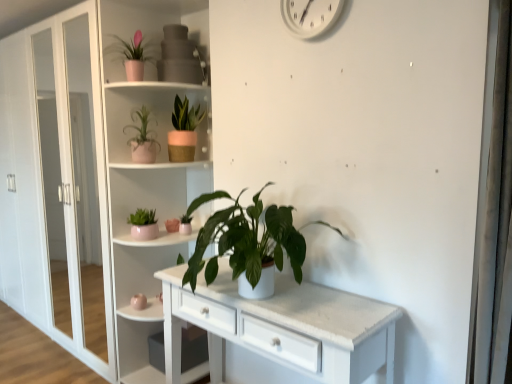
This screenshot has height=384, width=512. What do you see at coordinates (172, 225) in the screenshot? I see `matte pink vase at center` at bounding box center [172, 225].

What do you see at coordinates (310, 16) in the screenshot? I see `white plastic clock at upper center` at bounding box center [310, 16].

In order to face white plastic clock at upper center, should I rotate leftwards or rightwards?

Rotate your view right by about 7.416°.

What do you see at coordinates (144, 224) in the screenshot? This screenshot has width=512, height=384. I see `matte pink pot at center-left, the 2th houseplant from the bottom` at bounding box center [144, 224].

What do you see at coordinates (130, 55) in the screenshot?
I see `matte pink pot at upper left, placed as the fifth houseplant when sorted from bottom to top` at bounding box center [130, 55].

In order to click on green matte plant at center, arranged as the fifth houseplant when viewed from the top in this screenshot , I will do `click(246, 239)`.

Locate an element on the screen. Image resolution: width=512 pixels, height=384 pixels. white glossy shelves at center is located at coordinates (149, 170).

Find the location of a particular element. matte pink vase at center is located at coordinates (172, 225).

Is white plastic clock at upper center positioned behind matte pink vase at center?

No, the depth of white plastic clock at upper center is less than that of matte pink vase at center.

This screenshot has width=512, height=384. Identify the location of clock in front of the matte pink vase at center. (310, 16).

Between white plastic clock at upper center and matte pink vase at center, which one has smaller size?

matte pink vase at center.

Does white plastic clock at upper center have a greater height compared to matte pink vase at center?

Yes.

Is white glossy shelves at center far from matte pink pot at upper center, placed as the third houseplant when sorted from top to bottom?

No.

Which of these two, white glossy shelves at center or matte pink pot at upper center, which is counted as the 3th houseplant, starting from the bottom, is wider?

white glossy shelves at center.

Is white glossy shelves at center at the right side of matte pink pot at upper center, which is counted as the 3th houseplant, starting from the bottom?

Indeed, white glossy shelves at center is positioned on the right side of matte pink pot at upper center, which is counted as the 3th houseplant, starting from the bottom.

From a real-world perspective, count 1st houseplants upward from the white glossy shelves at center and point to it. Please provide its 2D coordinates.

[(143, 138)]

Consider the image. Is matte pink pot at center-left, the 2th houseplant from the bottom, further to the viewer compared to pink matte pot at upper center, placed as the second houseplant when sorted from top to bottom?

No, it is in front of pink matte pot at upper center, placed as the second houseplant when sorted from top to bottom.

Is matte pink pot at center-left, the 2th houseplant from the bottom, not within pink matte pot at upper center, the fourth houseplant positioned from the bottom?

Yes, matte pink pot at center-left, the 2th houseplant from the bottom, is located beyond the bounds of pink matte pot at upper center, the fourth houseplant positioned from the bottom.

Visually, is matte pink pot at center-left, which is the 4th houseplant from top to bottom, positioned to the left or to the right of pink matte pot at upper center, placed as the second houseplant when sorted from top to bottom?

Clearly, matte pink pot at center-left, which is the 4th houseplant from top to bottom, is on the left of pink matte pot at upper center, placed as the second houseplant when sorted from top to bottom, in the image.

Does matte pink pot at center-left, which is the 4th houseplant from top to bottom, have a smaller size compared to pink matte pot at upper center, placed as the second houseplant when sorted from top to bottom?

Correct, matte pink pot at center-left, which is the 4th houseplant from top to bottom, occupies less space than pink matte pot at upper center, placed as the second houseplant when sorted from top to bottom.

From the image's perspective, which is above, matte pink pot at upper left, placed as the fifth houseplant when sorted from bottom to top, or white plastic clock at upper center?

white plastic clock at upper center, from the image's perspective.

Do you think matte pink pot at upper left, marked as the 1th houseplant in a top-to-bottom arrangement, is within white plastic clock at upper center, or outside of it?

The correct answer is: outside.

From a real-world perspective, is pink matte pot at upper center, the fourth houseplant positioned from the bottom, physically above matte pink pot at upper center, placed as the third houseplant when sorted from top to bottom?

Yes, from a real-world perspective, pink matte pot at upper center, the fourth houseplant positioned from the bottom, is on top of matte pink pot at upper center, placed as the third houseplant when sorted from top to bottom.

Is pink matte pot at upper center, placed as the second houseplant when sorted from top to bottom, inside the boundaries of matte pink pot at upper center, which is counted as the 3th houseplant, starting from the bottom, or outside?

pink matte pot at upper center, placed as the second houseplant when sorted from top to bottom, is located beyond the bounds of matte pink pot at upper center, which is counted as the 3th houseplant, starting from the bottom.

Is point (173, 135) closer or farther from the camera than point (135, 111)?

Point (173, 135) is positioned farther from the camera compared to point (135, 111).

Between pink matte pot at upper center, placed as the second houseplant when sorted from top to bottom, and matte pink pot at upper center, which is counted as the 3th houseplant, starting from the bottom, which one has less height?

With less height is matte pink pot at upper center, which is counted as the 3th houseplant, starting from the bottom.

Who is more distant, matte pink pot at upper center, placed as the third houseplant when sorted from top to bottom, or matte pink pot at upper left, marked as the 1th houseplant in a top-to-bottom arrangement?

matte pink pot at upper center, placed as the third houseplant when sorted from top to bottom, is further from the camera.

Based on their positions, is matte pink pot at upper center, which is counted as the 3th houseplant, starting from the bottom, located to the left or right of matte pink pot at upper left, placed as the fifth houseplant when sorted from bottom to top?

Clearly, matte pink pot at upper center, which is counted as the 3th houseplant, starting from the bottom, is on the right of matte pink pot at upper left, placed as the fifth houseplant when sorted from bottom to top, in the image.

Is matte pink pot at upper center, placed as the third houseplant when sorted from top to bottom, bigger than matte pink pot at upper left, marked as the 1th houseplant in a top-to-bottom arrangement?

Correct, matte pink pot at upper center, placed as the third houseplant when sorted from top to bottom, is larger in size than matte pink pot at upper left, marked as the 1th houseplant in a top-to-bottom arrangement.

Is point (156, 122) positioned behind point (123, 52)?

That is True.

Considering the sizes of objects matte pink pot at center-left, the 2th houseplant from the bottom, and matte pink pot at upper left, placed as the fifth houseplant when sorted from bottom to top, in the image provided, who is bigger, matte pink pot at center-left, the 2th houseplant from the bottom, or matte pink pot at upper left, placed as the fifth houseplant when sorted from bottom to top,?

matte pink pot at upper left, placed as the fifth houseplant when sorted from bottom to top, is bigger.

Considering the positions of point (140, 212) and point (111, 34), is point (140, 212) closer or farther from the camera than point (111, 34)?

Clearly, point (140, 212) is more distant from the camera than point (111, 34).

From a real-world perspective, which object rests below the other?

matte pink pot at center-left, which is the 4th houseplant from top to bottom, from a real-world perspective.

Locate an element on the screen. flower on the left of white plastic clock at upper center is located at coordinates (172, 225).

Identify the location of bookshelf below the matte pink pot at upper center, placed as the third houseplant when sorted from top to bottom (from the image's perspective). This screenshot has height=384, width=512. [149, 170].

Looking at the image, which one is located further to matte pink pot at center-left, the 2th houseplant from the bottom, white plastic clock at upper center or pink matte pot at upper center, placed as the second houseplant when sorted from top to bottom?

white plastic clock at upper center lies further to matte pink pot at center-left, the 2th houseplant from the bottom, than the other object.

Which object lies further to the anchor point white glossy shelves at center, pink matte pot at upper center, placed as the second houseplant when sorted from top to bottom, or matte pink pot at center-left, which is the 4th houseplant from top to bottom?

matte pink pot at center-left, which is the 4th houseplant from top to bottom, is further to white glossy shelves at center.

Considering their positions, is white glossy shelves at center positioned further to white plastic clock at upper center than pink matte pot at upper center, the fourth houseplant positioned from the bottom?

white glossy shelves at center.

Considering their positions, is matte pink pot at center-left, which is the 4th houseplant from top to bottom, positioned closer to pink matte pot at upper center, placed as the second houseplant when sorted from top to bottom, than matte pink pot at upper center, placed as the third houseplant when sorted from top to bottom?

Based on the image, matte pink pot at upper center, placed as the third houseplant when sorted from top to bottom, appears to be nearer to pink matte pot at upper center, placed as the second houseplant when sorted from top to bottom.

Looking at this image, estimate the real-world distances between objects in this image. Which object is further from green matte plant at center, the first houseplant from the bottom, matte pink vase at center or white plastic clock at upper center?

The object further to green matte plant at center, the first houseplant from the bottom, is white plastic clock at upper center.

Which object lies nearer to the anchor point green matte plant at center, arranged as the fifth houseplant when viewed from the top, white plastic clock at upper center or pink matte pot at upper center, placed as the second houseplant when sorted from top to bottom?

Among the two, pink matte pot at upper center, placed as the second houseplant when sorted from top to bottom, is located nearer to green matte plant at center, arranged as the fifth houseplant when viewed from the top.

Estimate the real-world distances between objects in this image. Which object is closer to matte pink vase at center, white plastic clock at upper center or matte pink pot at upper center, placed as the third houseplant when sorted from top to bottom?

The object closer to matte pink vase at center is matte pink pot at upper center, placed as the third houseplant when sorted from top to bottom.

Looking at the image, which one is located closer to matte pink vase at center, matte pink pot at center-left, which is the 4th houseplant from top to bottom, or white glossy shelves at center?

matte pink pot at center-left, which is the 4th houseplant from top to bottom, is closer to matte pink vase at center.

Find the location of a particular element. The image size is (512, 384). bookshelf that lies between matte pink pot at upper center, placed as the third houseplant when sorted from top to bottom, and matte pink pot at center-left, which is the 4th houseplant from top to bottom, from top to bottom is located at coordinates (149, 170).

Image resolution: width=512 pixels, height=384 pixels. Find the location of `bookshelf that lies between white plastic clock at upper center and green matte plant at center, the first houseplant from the bottom, from top to bottom`. bookshelf that lies between white plastic clock at upper center and green matte plant at center, the first houseplant from the bottom, from top to bottom is located at coordinates (149, 170).

The width and height of the screenshot is (512, 384). Find the location of `bookshelf between pink matte pot at upper center, the fourth houseplant positioned from the bottom, and matte pink pot at center-left, which is the 4th houseplant from top to bottom, in the vertical direction`. bookshelf between pink matte pot at upper center, the fourth houseplant positioned from the bottom, and matte pink pot at center-left, which is the 4th houseplant from top to bottom, in the vertical direction is located at coordinates (149, 170).

The width and height of the screenshot is (512, 384). In order to click on bookshelf between matte pink pot at upper left, marked as the 1th houseplant in a top-to-bottom arrangement, and white plastic clock at upper center from left to right in this screenshot , I will do coord(149,170).